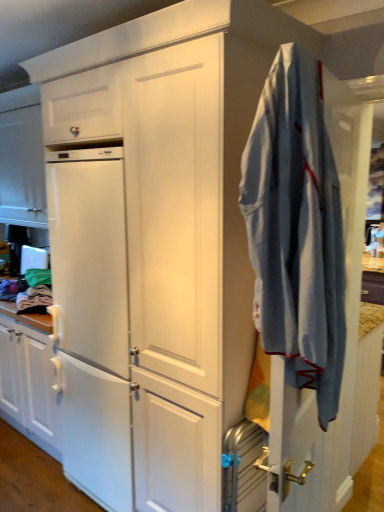
What do you see at coordinates (297, 228) in the screenshot?
I see `light blue cotton shirt at right` at bounding box center [297, 228].

The height and width of the screenshot is (512, 384). I want to click on light blue cotton shirt at right, so click(x=297, y=228).

You are a GUI agent. You are given a task and a screenshot of the screen. Output one action in this format:
    pyautogui.click(x=<x>, y=<y>)
    Task: Click on the light blue cotton shirt at right
    Image resolution: width=384 pixels, height=512 pixels.
    Given the screenshot: What is the action you would take?
    click(x=297, y=228)